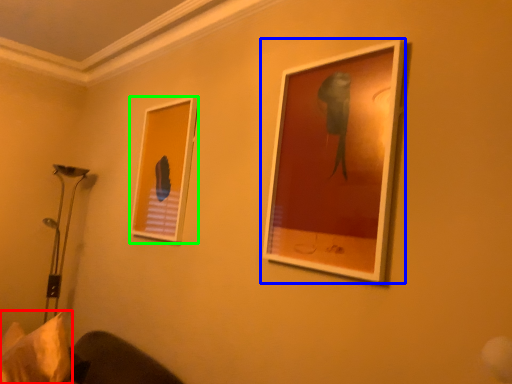
Question: Which object is the farthest from pillow (highlighted by a red box)? Choose among these: picture frame (highlighted by a blue box) or picture frame (highlighted by a green box).

Choices:
 (A) picture frame
 (B) picture frame

Answer: (A)